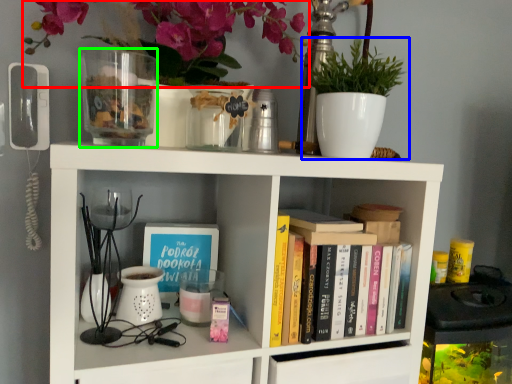
Question: Considering the real-world distances, which object is closest to floral arrangement (highlighted by a red box)? houseplant (highlighted by a blue box) or glass vase (highlighted by a green box).

Choices:
 (A) houseplant
 (B) glass vase

Answer: (B)